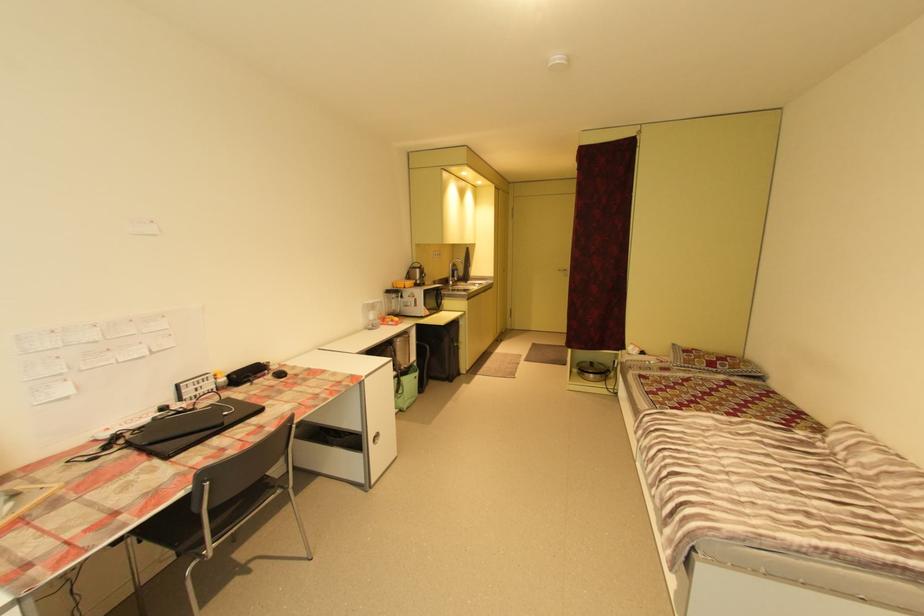
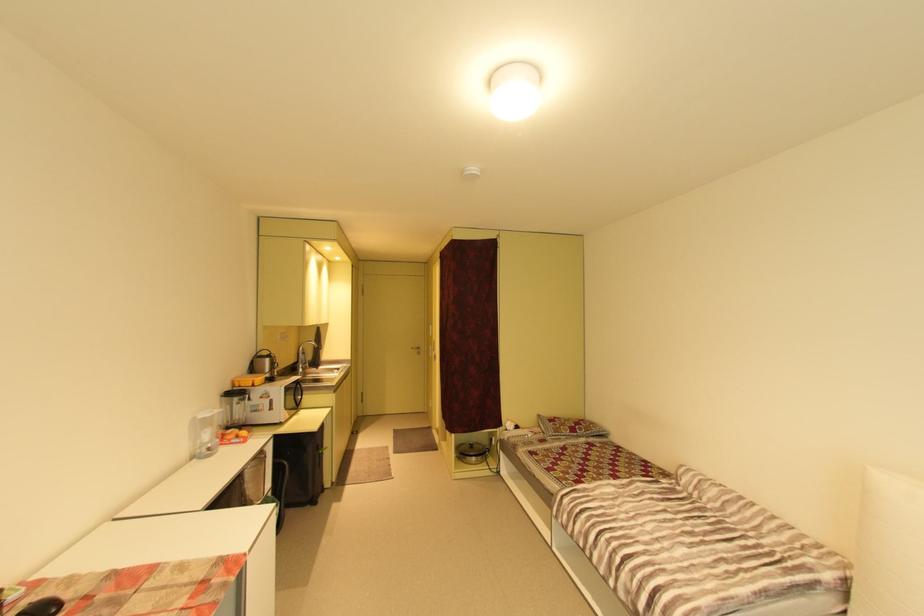
Locate, in the second image, the point that corresponds to pixel 702 360 in the first image.

(568, 428)